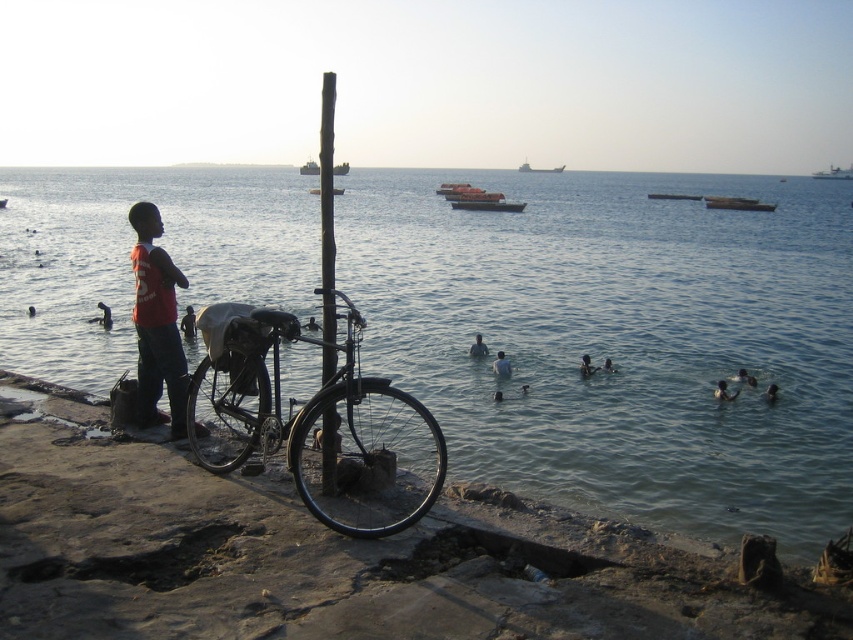
Between metallic silver boat at upper right and metallic gray ship at upper center, which one is positioned higher?

metallic gray ship at upper center

Is metallic silver boat at upper right taller than metallic gray ship at upper center?

Yes.

Between point (814, 173) and point (527, 168), which one is positioned in front?

Point (527, 168)

Identify the location of metallic silver boat at upper right. The image size is (853, 640). (834, 173).

Image resolution: width=853 pixels, height=640 pixels. What do you see at coordinates (621, 339) in the screenshot? I see `clear water at lower center` at bounding box center [621, 339].

Is clear water at lower center taller than metallic gray ship at upper center?

Yes.

Which is in front, point (833, 205) or point (548, 172)?

Point (833, 205) is more forward.

Where is `clear water at lower center`? clear water at lower center is located at coordinates click(x=621, y=339).

Does smooth concrete shore at lower left have a smaller size compared to smooth black pole at center?

Indeed, smooth concrete shore at lower left has a smaller size compared to smooth black pole at center.

Is point (466, 632) positioned in front of point (325, 333)?

Yes, it is in front of point (325, 333).

Is point (251, 598) closer to camera compared to point (326, 328)?

Yes, it is.

Where is `smooth concrete shore at lower left`? The width and height of the screenshot is (853, 640). smooth concrete shore at lower left is located at coordinates (332, 556).